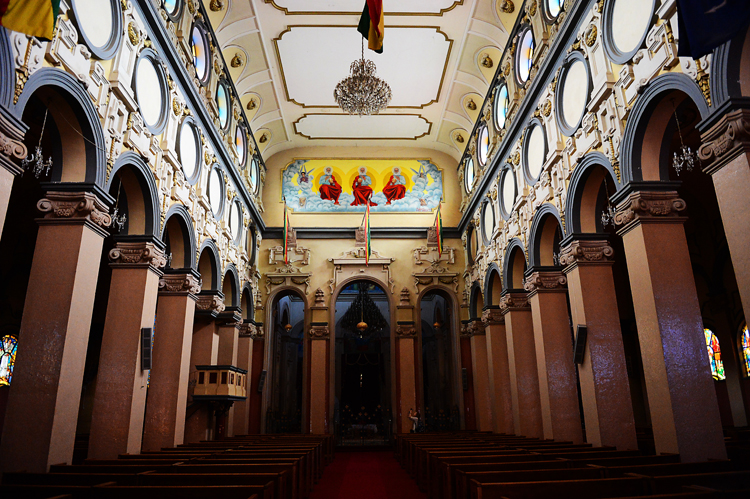
You are a GUI agent. You are given a task and a screenshot of the screen. Output one action in this format:
    pyautogui.click(x=<x>, y=<y>)
    Task: Click on the white circles on the walls
    
    Given the screenshot: What is the action you would take?
    pyautogui.click(x=94, y=27), pyautogui.click(x=150, y=68), pyautogui.click(x=189, y=140), pyautogui.click(x=218, y=183), pyautogui.click(x=232, y=219), pyautogui.click(x=486, y=216), pyautogui.click(x=510, y=188), pyautogui.click(x=538, y=145), pyautogui.click(x=584, y=84), pyautogui.click(x=634, y=20)